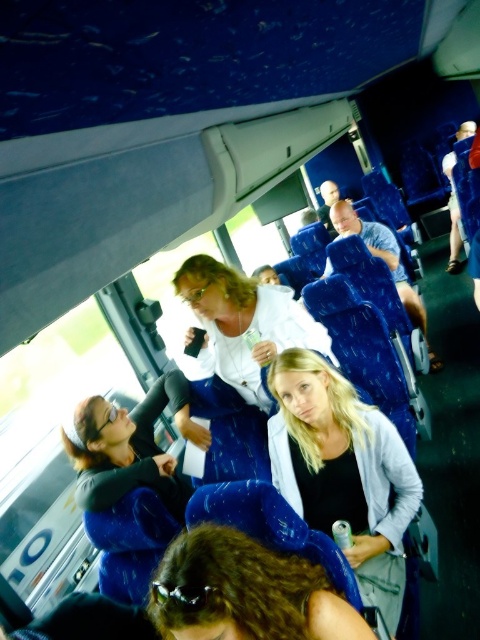
You are a photographer trying to capture a closeup of the white matte jacket at center and the blue fabric seat at center. Since you want to focus on the jacket, which object should you place closer to the camera?

The white matte jacket at center is smaller than the blue fabric seat at center, so to focus on the jacket, you should place it closer to the camera.

You are a photographer standing in the bus and you want to take a photo of the light blue denim jacket at center and the white matte jacket at center. Which jacket is narrower when viewed from the front?

The light blue denim jacket at center is thinner than the white matte jacket at center, so the light blue denim jacket at center is narrower when viewed from the front.